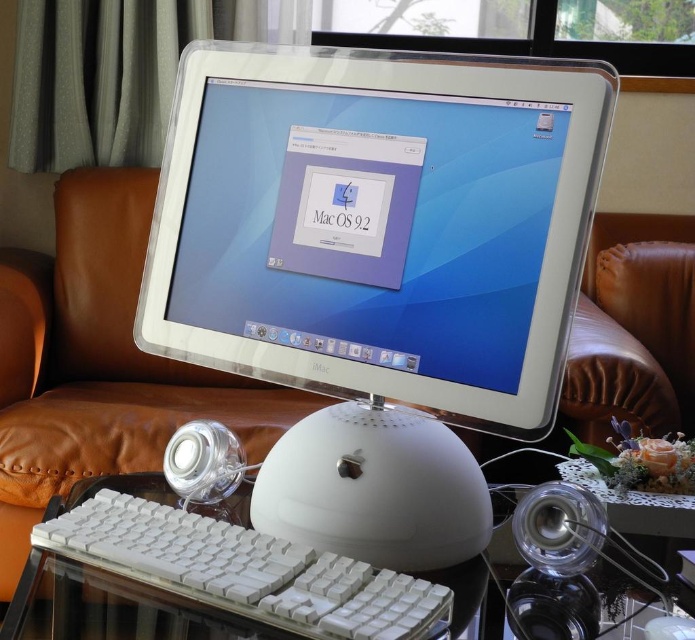
Locate an element on the screen. The height and width of the screenshot is (640, 695). white plastic mouse at center is located at coordinates (375, 488).

Which is behind, point (293, 515) or point (92, 529)?

Point (293, 515)

Is point (284, 442) less distant than point (158, 532)?

That is False.

Locate an element on the screen. Image resolution: width=695 pixels, height=640 pixels. white plastic mouse at center is located at coordinates [375, 488].

Which is behind, point (302, 524) or point (245, 573)?

The point (302, 524) is more distant.

Does white plastic imac at center appear on the left side of white plastic keyboard at center?

In fact, white plastic imac at center is to the right of white plastic keyboard at center.

Between point (389, 220) and point (58, 516), which one is positioned behind?

Point (58, 516)

Identify the location of white plastic imac at center. [x=377, y=269].

How far apart are white plastic imac at center and white plastic mouse at center?

white plastic imac at center is 4.41 inches away from white plastic mouse at center.

Between point (523, 243) and point (425, 467), which one is positioned in front?

Point (523, 243) is more forward.

Does point (384, 474) come behind point (376, 516)?

Yes, point (384, 474) is behind point (376, 516).

At what (x,y) coordinates should I click in order to perform the action: click on white plastic imac at center. Please return your answer as a coordinate pair (x, y). The width and height of the screenshot is (695, 640). Looking at the image, I should click on (377, 269).